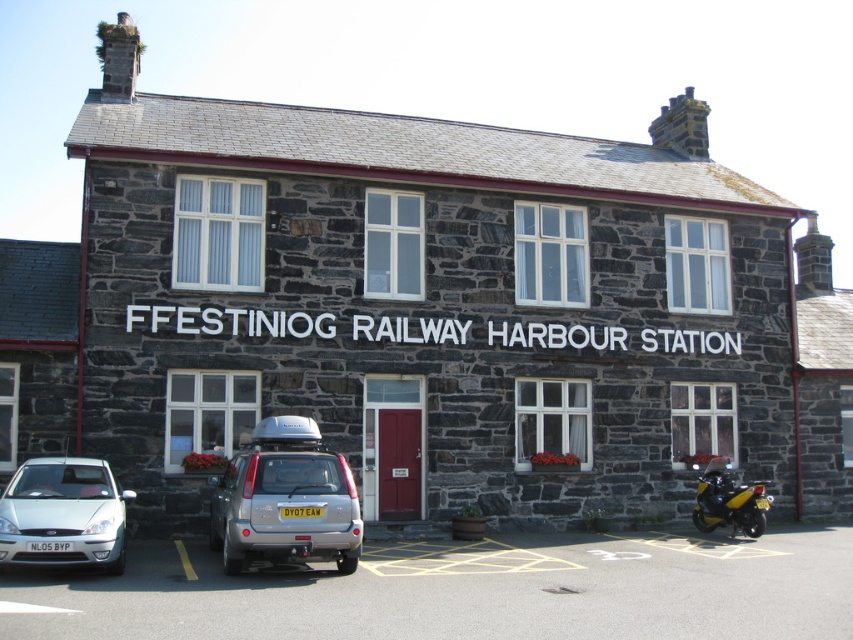
You are standing in front of the FFESTINIOG RAILWAY HARBOUR STATION and want to park your vehicle. You have a silver metallic car at lower left and a yellow matte motorcycle at lower right. Which vehicle is closer to the left side of the station?

The silver metallic car at lower left is positioned on the left side of yellow matte motorcycle at lower right, so it is closer to the left side of the station.

You are a photographer planning to take a photo of the FFESTINIOG RAILWAY HARBOUR STATION. You want to ensure both the yellow matte motorcycle at lower right and the white plastic license plate at center are clearly visible in the frame. Based on their sizes, which object should you focus on first to ensure both are in focus?

The yellow matte motorcycle at lower right is taller than the white plastic license plate at center, so focusing on the motorcycle first would help ensure both are in focus since it is larger and requires more attention to detail.

You are standing at the entrance of the FFESTINIOG RAILWAY HARBOUR STATION and need to park your yellow matte motorcycle at lower right. According to the image, where should you position it relative to the station building?

The yellow matte motorcycle at lower right should be positioned at the coordinates point [728,500] relative to the station building.